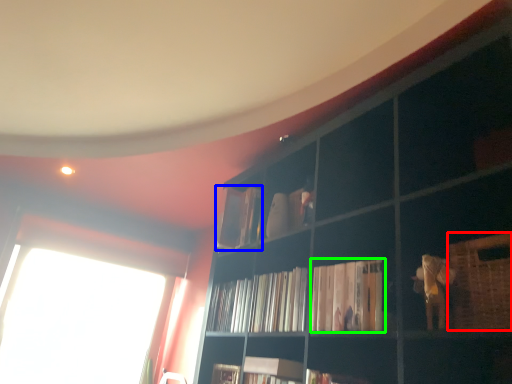
Question: Estimate the real-world distances between objects in this image. Which object is farther from basket (highlighted by a red box), book (highlighted by a blue box) or book (highlighted by a green box)?

Choices:
 (A) book
 (B) book

Answer: (A)